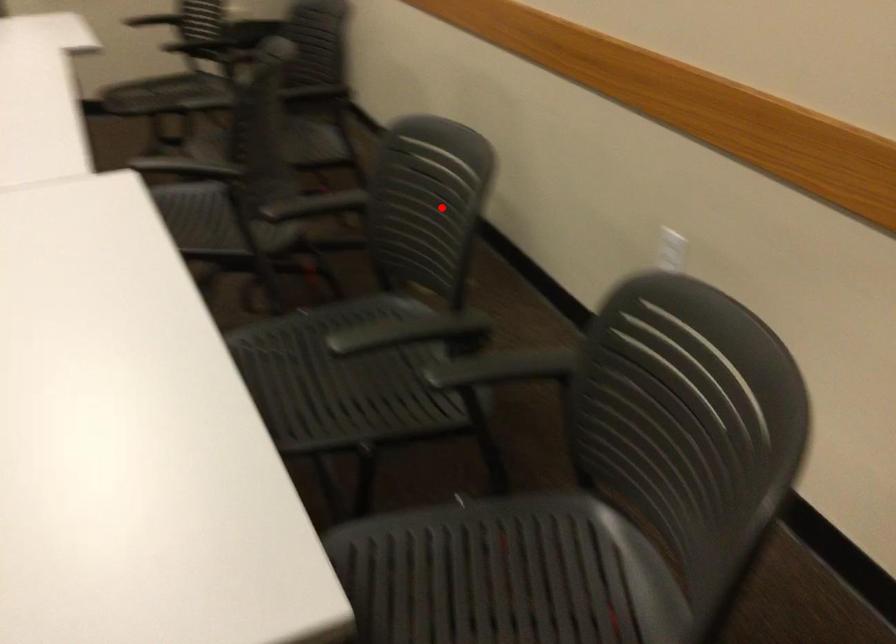
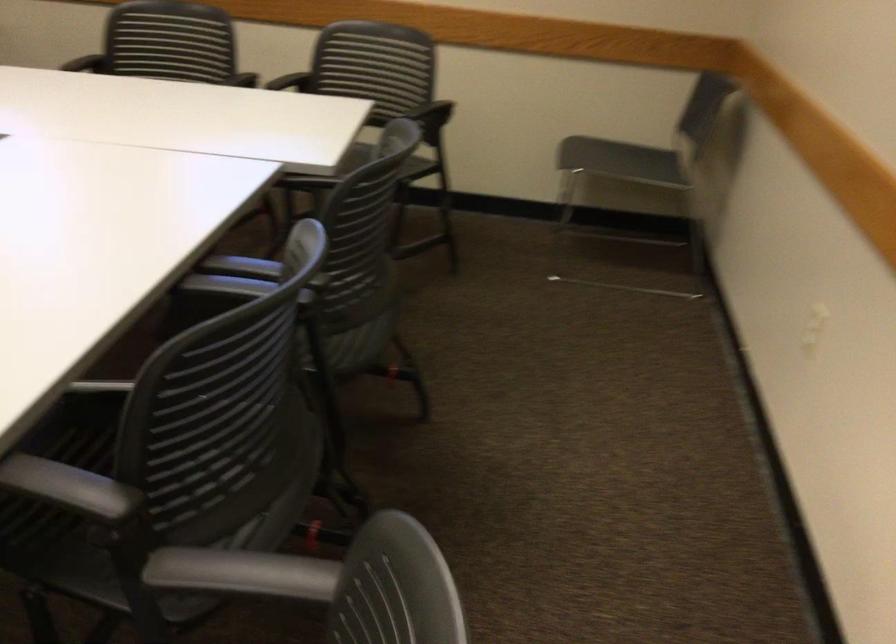
The point at the highlighted location is marked in the first image. Where is the corresponding point in the second image?

(168, 41)